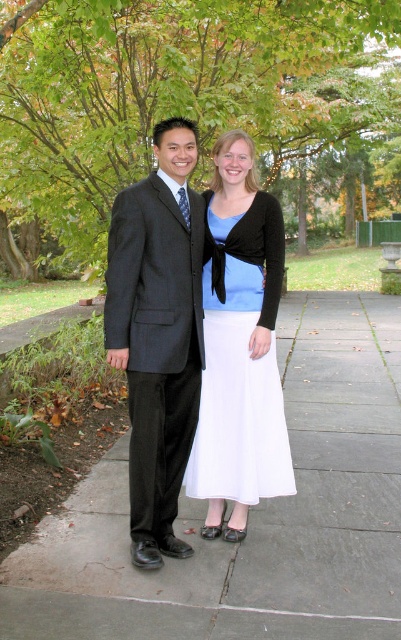
Question: Which is farther from the gray concrete pavement at center?

Choices:
 (A) matte black suit at center
 (B) green leafy tree at upper center
 (C) white satin dress at center
 (D) dark gray pinstripe suit at center

Answer: (B)

Question: Can you confirm if green leafy tree at upper center is positioned to the left of white satin dress at center?

Choices:
 (A) yes
 (B) no

Answer: (A)

Question: Which point is closer to the camera?

Choices:
 (A) (145, 202)
 (B) (307, 518)

Answer: (A)

Question: Can you confirm if dark gray pinstripe suit at center is wider than white satin dress at center?

Choices:
 (A) yes
 (B) no

Answer: (B)

Question: Does green leafy tree at upper center appear on the left side of gray concrete pavement at center?

Choices:
 (A) yes
 (B) no

Answer: (B)

Question: Among these points, which one is farthest from the camera?

Choices:
 (A) (324, 106)
 (B) (326, 589)
 (C) (265, 448)
 (D) (186, 326)

Answer: (A)